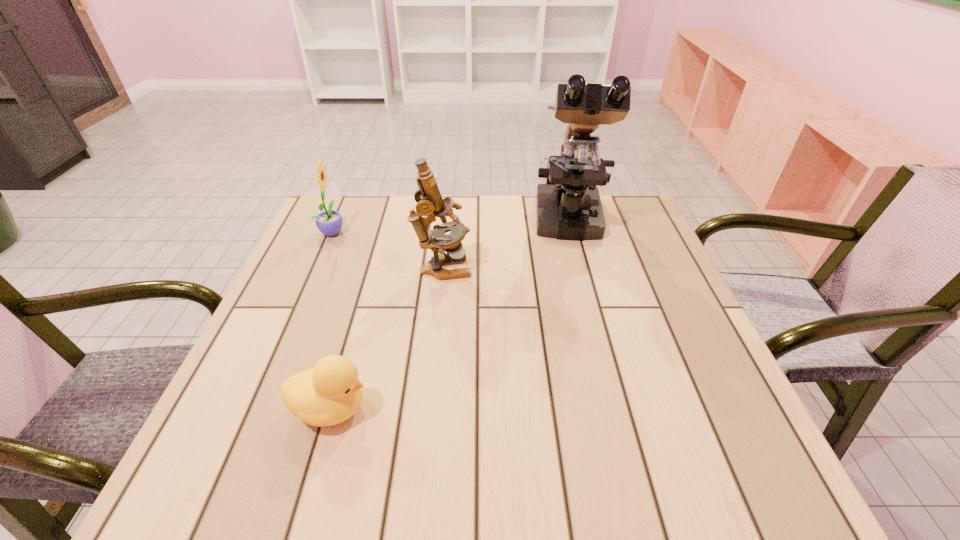
Locate an element on the screen. The width and height of the screenshot is (960, 540). free area in between the nearer microscope and the leftmost object is located at coordinates (388, 250).

At what (x,y) coordinates should I click in order to perform the action: click on vacant point located between the rightmost object and the second tallest object. Please return your answer as a coordinate pair (x, y). The width and height of the screenshot is (960, 540). Looking at the image, I should click on (506, 246).

The width and height of the screenshot is (960, 540). I want to click on empty space that is in between the shortest object and the leftmost object, so click(331, 320).

Image resolution: width=960 pixels, height=540 pixels. What are the coordinates of `vacant area that lies between the taller microscope and the second object from right to left` in the screenshot? It's located at (506, 246).

Image resolution: width=960 pixels, height=540 pixels. What are the coordinates of `object that stands as the third closest to the second shortest object` in the screenshot? It's located at (568, 207).

This screenshot has width=960, height=540. I want to click on object that is the third closest to the duck, so click(568, 207).

Find the location of a particular element. The image size is (960, 540). vacant space that satisfies the following two spatial constraints: 1. on the front-facing side of the second nearest object; 2. on the left side of the sunflower is located at coordinates (317, 269).

Image resolution: width=960 pixels, height=540 pixels. I want to click on free point that satisfies the following two spatial constraints: 1. on the front-facing side of the sunflower; 2. on the right side of the nearer microscope, so [317, 269].

You are a GUI agent. You are given a task and a screenshot of the screen. Output one action in this format:
    pyautogui.click(x=<x>, y=<y>)
    Task: Click on the vacant area in the image that satisfies the following two spatial constraints: 1. on the front-facing side of the second shortest object; 2. on the right side of the second tallest object
    The height and width of the screenshot is (540, 960).
    Given the screenshot: What is the action you would take?
    pyautogui.click(x=317, y=269)

The image size is (960, 540). I want to click on blank area in the image that satisfies the following two spatial constraints: 1. on the back side of the left microscope; 2. on the front-facing side of the leftmost object, so click(x=446, y=231).